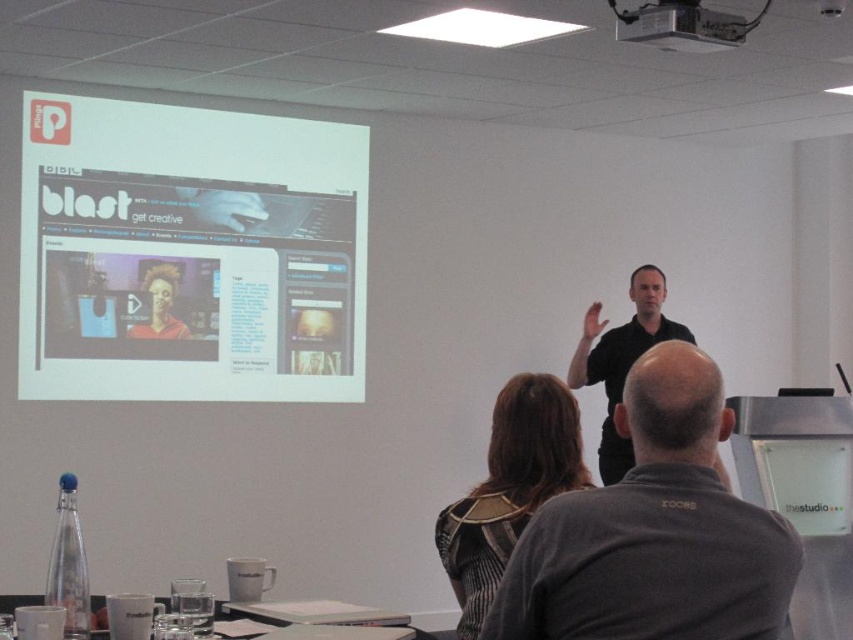
You are a photographer taking a portrait of the black matte shirt at center and the metallic projector at upper center. Which object should you focus on first if you want to capture both in the same frame without moving the camera?

The black matte shirt at center has a greater height compared to the metallic projector at upper center, so you should focus on the black matte shirt at center first to ensure it is in clear view before adjusting for the smaller metallic projector at upper center.

You are a photographer at the back of the room. You want to take a photo of the black matte shirt at center and the metallic projector at upper center. Which object should be placed on the right side in your photo?

The black matte shirt at center should be on the right side in your photo because it is positioned on the right side of the metallic projector at upper center.

You are a photographer trying to capture a photo of both the striped fabric dress at center and the black matte shirt at center. Which one should you focus on first if you want to include both in your frame without moving the camera?

The striped fabric dress at center is positioned on the left side of the black matte shirt at center, so you should focus on the striped fabric dress at center first to ensure both are in frame.